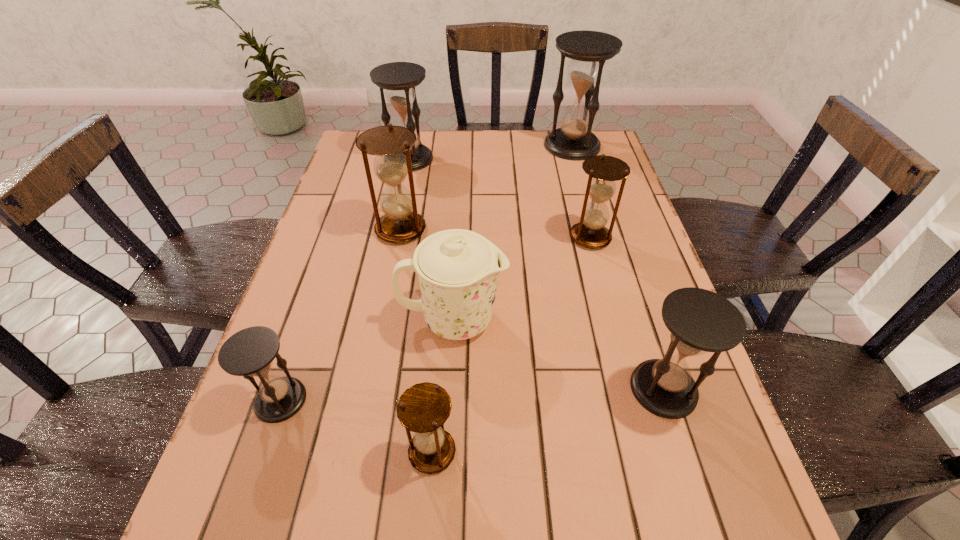
Where is `the nearest brown hourglass`? the nearest brown hourglass is located at coordinates (423, 408).

Locate an element on the screen. vacant area situated 0.230m on the front of the biggest black hourglass is located at coordinates (588, 205).

You are a GUI agent. You are given a task and a screenshot of the screen. Output one action in this format:
    pyautogui.click(x=<x>, y=<y>)
    Task: Click on the blank area located on the front of the second black hourglass from left to right
    
    Given the screenshot: What is the action you would take?
    pyautogui.click(x=391, y=246)

I want to click on free space located 0.060m on the front of the leftmost brown hourglass, so click(395, 264).

Where is `free space located on the spout of the fifth farthest object`? The height and width of the screenshot is (540, 960). free space located on the spout of the fifth farthest object is located at coordinates 553,320.

Find the location of a particular element. vacant space situated 0.050m on the left of the second smallest black hourglass is located at coordinates (605, 389).

Where is `free location located on the left of the rightmost brown hourglass`? free location located on the left of the rightmost brown hourglass is located at coordinates pyautogui.click(x=511, y=237).

You are a GUI agent. You are given a task and a screenshot of the screen. Output one action in this format:
    pyautogui.click(x=<x>, y=<y>)
    Task: Click on the free space located on the right of the leftmost hourglass
    Image resolution: width=960 pixels, height=540 pixels.
    Given the screenshot: What is the action you would take?
    pyautogui.click(x=338, y=400)

Locate an element on the screen. vacant space located 0.270m on the back of the nearest object is located at coordinates (443, 311).

You are a GUI agent. You are given a task and a screenshot of the screen. Output one action in this format:
    pyautogui.click(x=<x>, y=<y>)
    Task: Click on the object located in the far left corner section of the desktop
    
    Given the screenshot: What is the action you would take?
    pyautogui.click(x=399, y=79)